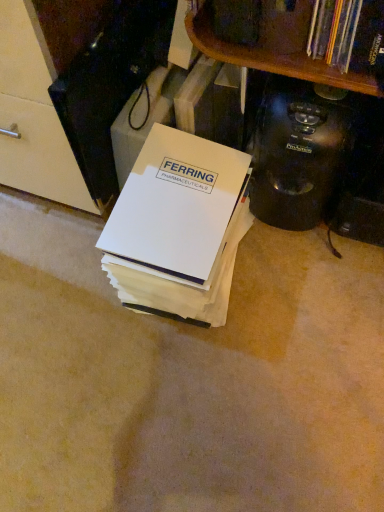
What are the coordinates of `vacant space to the left of white paper at center` in the screenshot? It's located at (58, 288).